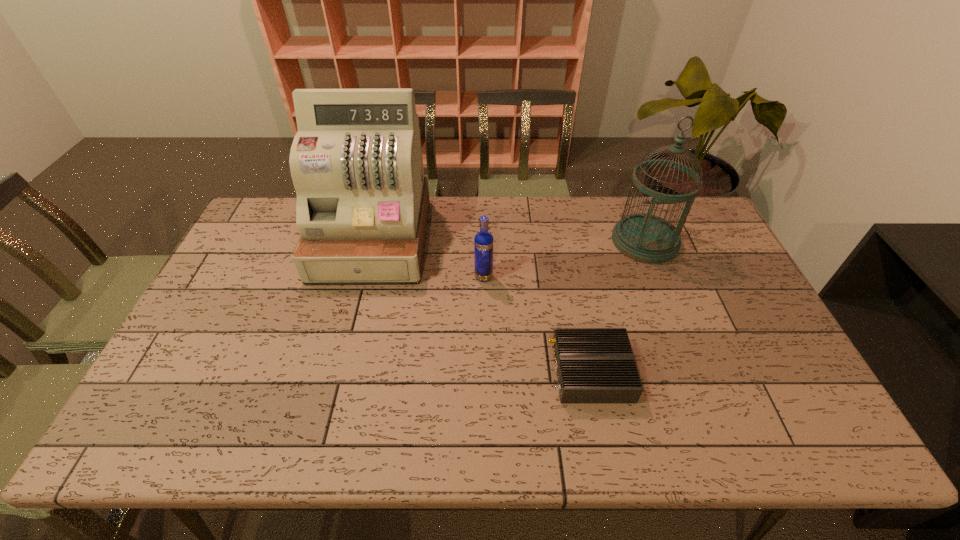
Where is `free space located 0.220m on the back panel of the router`? free space located 0.220m on the back panel of the router is located at coordinates (463, 372).

Locate an element on the screen. Image resolution: width=960 pixels, height=540 pixels. vacant space located on the back panel of the router is located at coordinates (479, 372).

Identify the location of cash register located at the far edge. The height and width of the screenshot is (540, 960). (356, 163).

In order to click on birdcage at the far edge in this screenshot , I will do `click(647, 238)`.

The width and height of the screenshot is (960, 540). What are the coordinates of `object present at the right edge` in the screenshot? It's located at (647, 238).

Image resolution: width=960 pixels, height=540 pixels. In order to click on object positioned at the far right corner in this screenshot , I will do `click(647, 238)`.

At what (x,y) coordinates should I click in order to perform the action: click on free space at the far edge of the desktop. Please return your answer as a coordinate pair (x, y). This screenshot has width=960, height=540. Looking at the image, I should click on (458, 201).

Find the location of a particular element. The height and width of the screenshot is (540, 960). vacant space at the near edge of the desktop is located at coordinates (317, 432).

The height and width of the screenshot is (540, 960). I want to click on free space at the left edge of the desktop, so click(267, 251).

You are a GUI agent. You are given a task and a screenshot of the screen. Output one action in this format:
    pyautogui.click(x=<x>, y=<y>)
    Task: Click on the free space at the right edge of the desktop
    
    Given the screenshot: What is the action you would take?
    pyautogui.click(x=809, y=410)